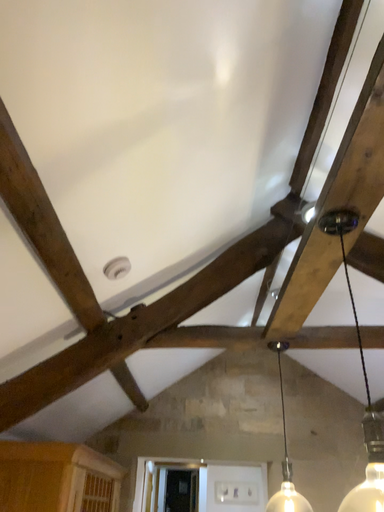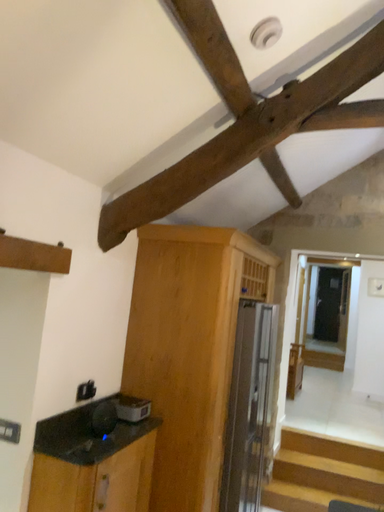
Question: How did the camera likely rotate when shooting the video?

Choices:
 (A) rotated upward
 (B) rotated downward

Answer: (B)